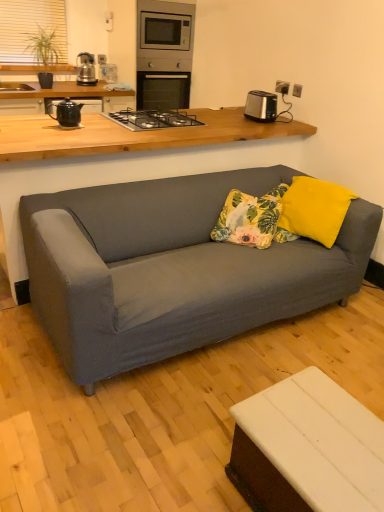
At what (x,y) coordinates should I click in order to perform the action: click on vacant space situated above white matte table at lower right, the 1th table when ordered from bottom to top (from a real-world perspective). Please return your answer as a coordinate pair (x, y). The height and width of the screenshot is (512, 384). Looking at the image, I should click on (327, 428).